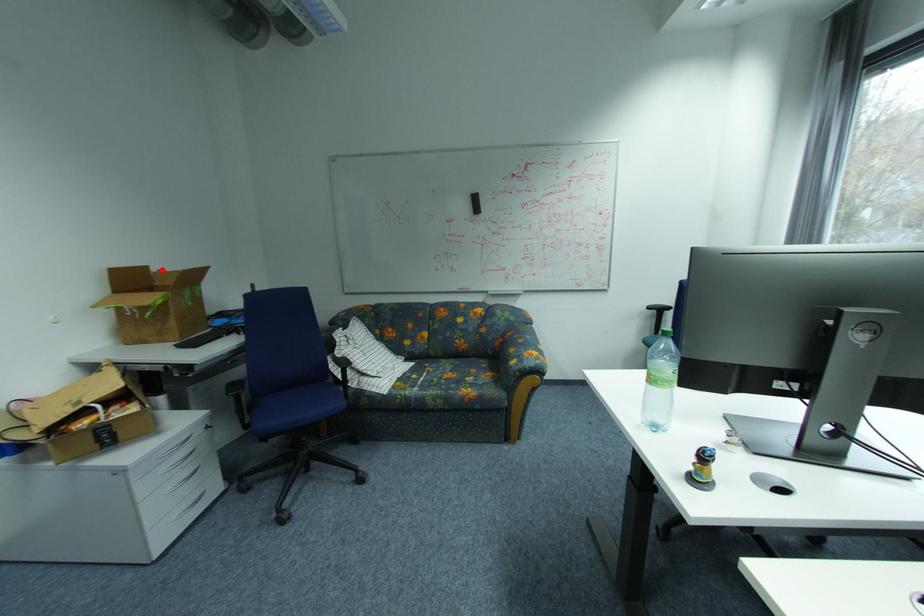
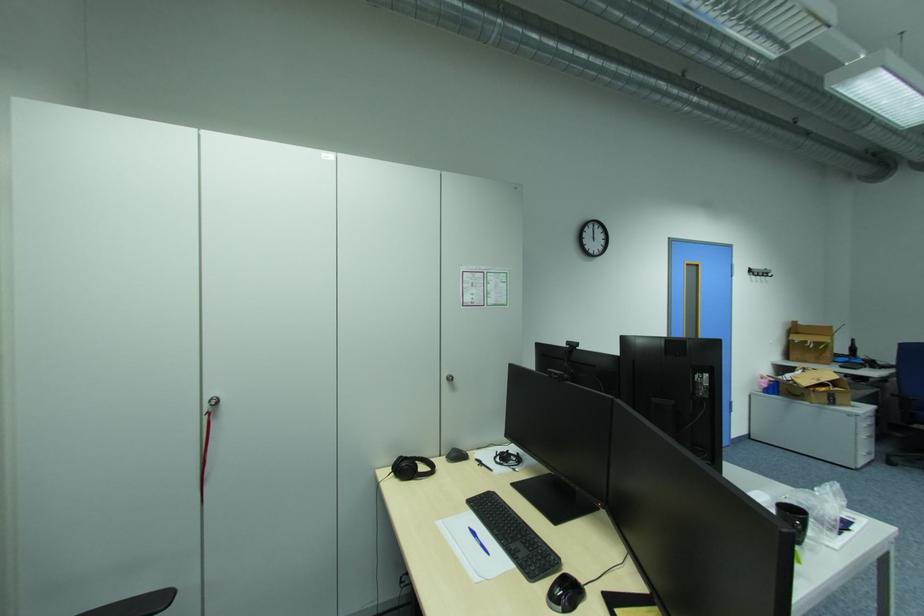
Where in the second image is the point corresponding to the highlighted location from the first image?

(808, 323)